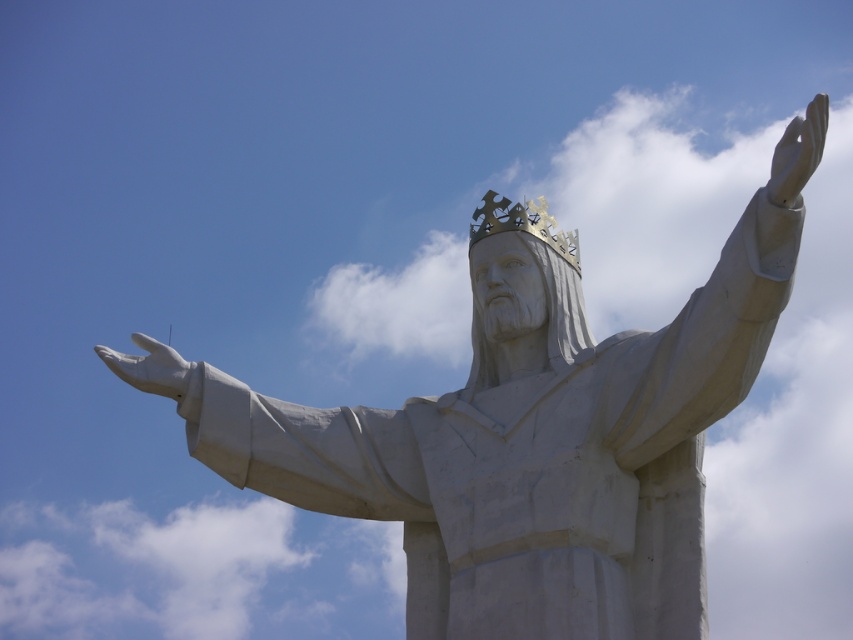
Can you confirm if gold metallic crown at center is positioned to the left of white matte hand at lower left?

No, gold metallic crown at center is not to the left of white matte hand at lower left.

Looking at this image, does gold metallic crown at center have a greater height compared to white matte hand at lower left?

Yes.

Does point (515, 211) come farther from viewer compared to point (155, 372)?

That is True.

Identify the location of gold metallic crown at center. The width and height of the screenshot is (853, 640). (523, 225).

Is white matte hand at upper right positioned in front of gold metallic crown at center?

That is True.

Can you confirm if white matte hand at upper right is wider than gold metallic crown at center?

Correct, the width of white matte hand at upper right exceeds that of gold metallic crown at center.

The height and width of the screenshot is (640, 853). What do you see at coordinates (798, 152) in the screenshot?
I see `white matte hand at upper right` at bounding box center [798, 152].

Image resolution: width=853 pixels, height=640 pixels. Find the location of `white matte hand at upper right`. white matte hand at upper right is located at coordinates (798, 152).

Is white matte hand at upper right wider than white matte hand at lower left?

Correct, the width of white matte hand at upper right exceeds that of white matte hand at lower left.

Measure the distance between point (796, 188) and camera.

Point (796, 188) is 68.63 meters from camera.

Between point (815, 147) and point (148, 365), which one is positioned in front?

Point (815, 147)

This screenshot has width=853, height=640. Find the location of `white matte hand at upper right`. white matte hand at upper right is located at coordinates (798, 152).